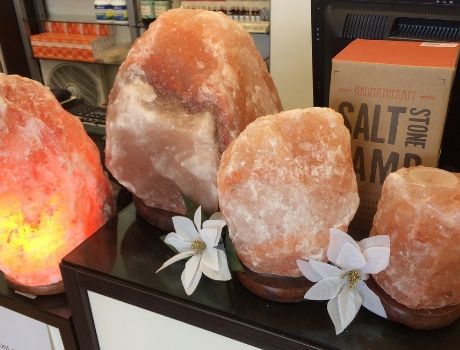
I want to click on glowing salt rock, so click(x=31, y=229).